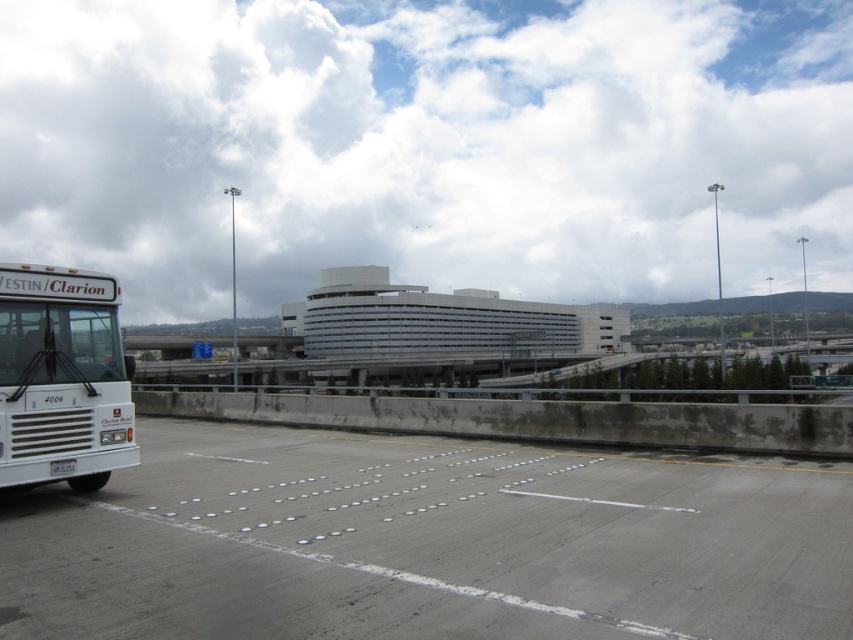
Which is more to the left, gray concrete highway at center or white matte bus at left?

Positioned to the left is white matte bus at left.

Which is in front, point (444, 496) or point (73, 298)?

Point (73, 298) is in front.

The image size is (853, 640). I want to click on gray concrete highway at center, so click(427, 541).